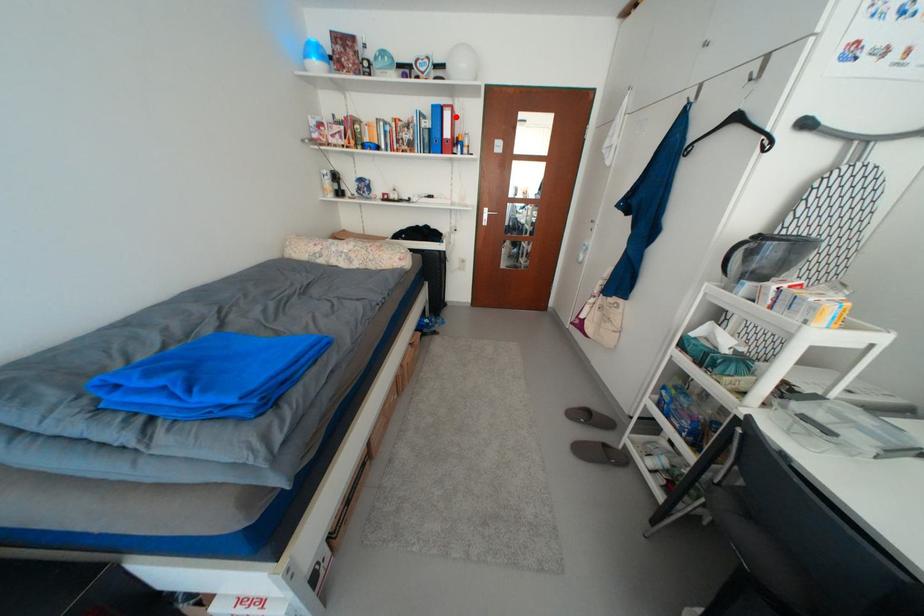
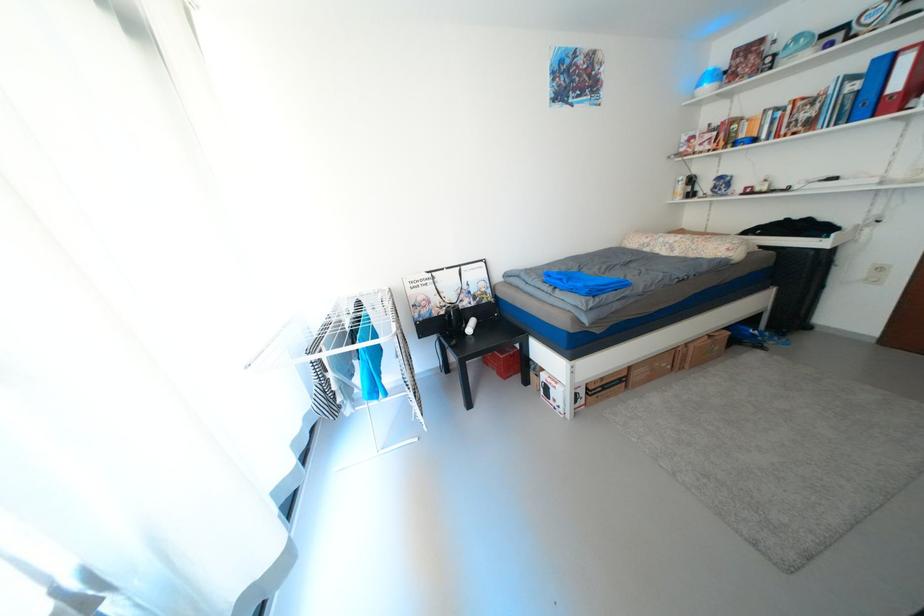
Question: I am providing you with two images of the same scene from different viewpoints. In image1, a red point is highlighted. Considering the same 3D point in image2, which of the following is correct?

Choices:
 (A) It is closer
 (B) It is farther

Answer: (B)